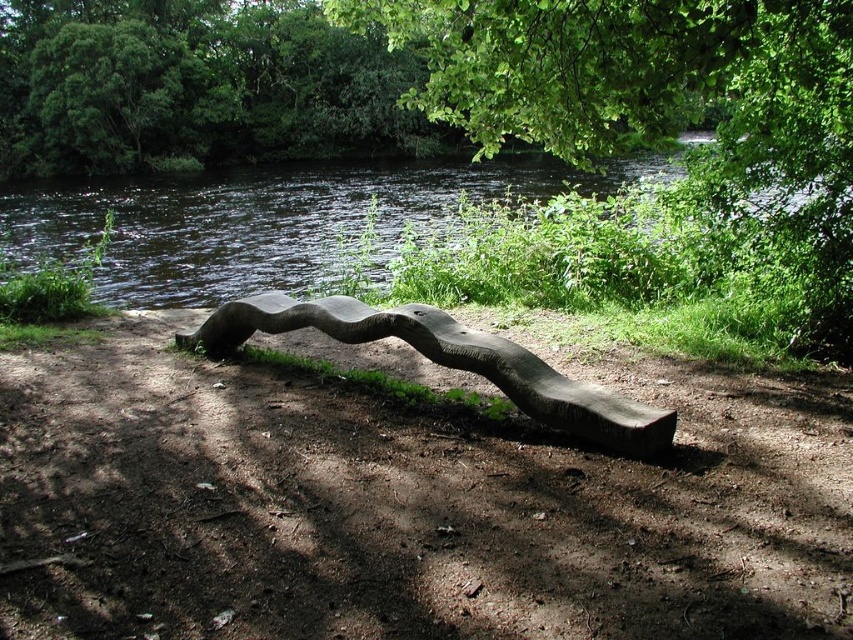
Question: Is green leafy river at center to the right of dark brown wood bench at center from the viewer's perspective?

Choices:
 (A) no
 (B) yes

Answer: (A)

Question: Is green leafy tree at upper center below green leafy river at center?

Choices:
 (A) no
 (B) yes

Answer: (A)

Question: Estimate the real-world distances between objects in this image. Which object is farther from the green leafy tree at upper center?

Choices:
 (A) green leafy river at center
 (B) dark brown wood bench at center

Answer: (A)

Question: Considering the real-world distances, which object is closest to the green leafy river at center?

Choices:
 (A) green leafy tree at upper center
 (B) dark brown wood bench at center

Answer: (A)

Question: Does green leafy tree at upper center have a greater width compared to green leafy river at center?

Choices:
 (A) yes
 (B) no

Answer: (B)

Question: Which point is farther from the camera taking this photo?

Choices:
 (A) (598, 419)
 (B) (325, 248)
 (C) (471, 36)

Answer: (B)